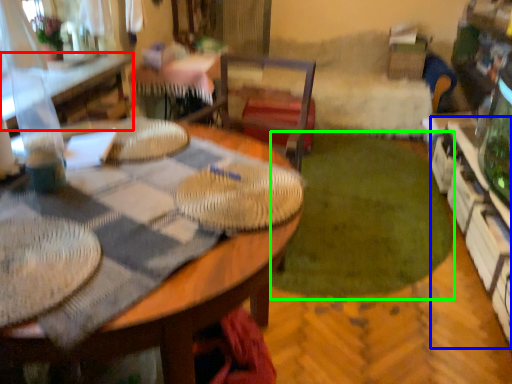
Question: Which is farther away from table (highlighted by a red box)? shelf (highlighted by a blue box) or grass (highlighted by a green box)?

Choices:
 (A) shelf
 (B) grass

Answer: (A)